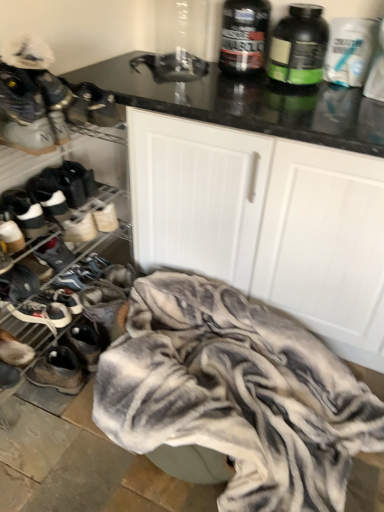
Question: Does white matte protein powder bottle at upper right, which appears as the 3th bottle when viewed from the left, lie behind black matte protein powder container at upper right, the second bottle in the right-to-left sequence?

Choices:
 (A) yes
 (B) no

Answer: (A)

Question: Can you confirm if white matte protein powder bottle at upper right, positioned as the 1th bottle in right-to-left order, is positioned to the right of black matte protein powder container at upper right, acting as the 2th bottle starting from the left?

Choices:
 (A) no
 (B) yes

Answer: (B)

Question: From the image's perspective, is white matte protein powder bottle at upper right, positioned as the 1th bottle in right-to-left order, on black matte protein powder container at upper right, the second bottle in the right-to-left sequence?

Choices:
 (A) no
 (B) yes

Answer: (A)

Question: Considering the relative sizes of white matte protein powder bottle at upper right, which appears as the 3th bottle when viewed from the left, and black matte protein powder container at upper right, acting as the 2th bottle starting from the left, in the image provided, is white matte protein powder bottle at upper right, which appears as the 3th bottle when viewed from the left, taller than black matte protein powder container at upper right, acting as the 2th bottle starting from the left,?

Choices:
 (A) no
 (B) yes

Answer: (A)

Question: From a real-world perspective, is white matte protein powder bottle at upper right, positioned as the 1th bottle in right-to-left order, positioned under black matte protein powder container at upper right, the second bottle in the right-to-left sequence, based on gravity?

Choices:
 (A) yes
 (B) no

Answer: (A)

Question: Is white matte protein powder bottle at upper right, positioned as the 1th bottle in right-to-left order, facing towards black matte protein powder container at upper right, the second bottle in the right-to-left sequence?

Choices:
 (A) yes
 (B) no

Answer: (B)

Question: Is white matte cabinet at center thinner than black plastic bottle at upper right, which is the third bottle in right-to-left order?

Choices:
 (A) yes
 (B) no

Answer: (B)

Question: Is white matte cabinet at center not within black plastic bottle at upper right, which is the third bottle in right-to-left order?

Choices:
 (A) no
 (B) yes

Answer: (B)

Question: Does white matte cabinet at center have a lesser height compared to black plastic bottle at upper right, the first bottle in the left-to-right sequence?

Choices:
 (A) no
 (B) yes

Answer: (A)

Question: Can you confirm if white matte cabinet at center is taller than black plastic bottle at upper right, which is the third bottle in right-to-left order?

Choices:
 (A) no
 (B) yes

Answer: (B)

Question: Would you say white matte cabinet at center is a long distance from black plastic bottle at upper right, which is the third bottle in right-to-left order?

Choices:
 (A) no
 (B) yes

Answer: (A)

Question: Could black plastic bottle at upper right, which is the third bottle in right-to-left order, be considered to be inside white matte cabinet at center?

Choices:
 (A) no
 (B) yes

Answer: (A)

Question: Does dark gray suede sneaker at lower left, acting as the eighth footwear starting from the top, have a lesser width compared to white textured blanket at lower center?

Choices:
 (A) yes
 (B) no

Answer: (A)